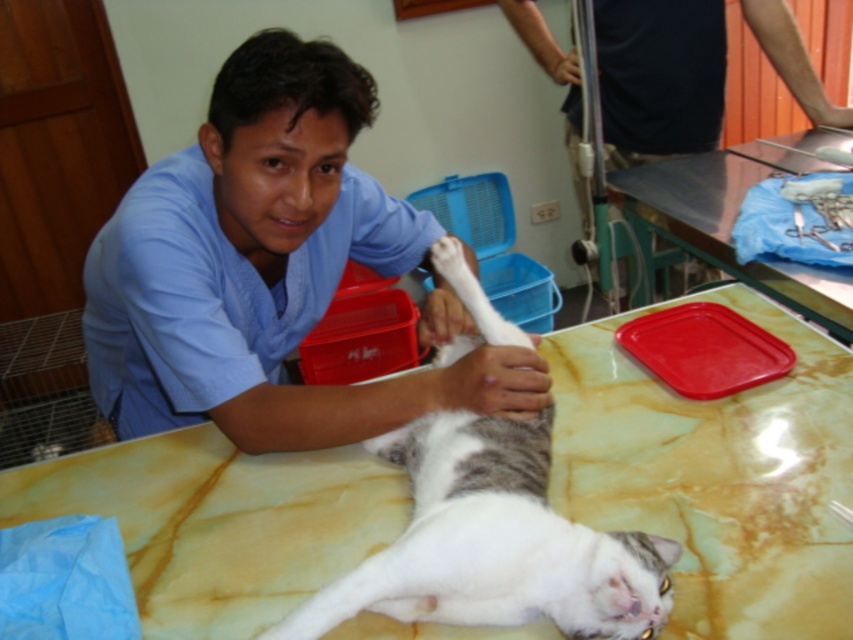
Question: Does white fur cat at center appear under red plastic tray at upper right?

Choices:
 (A) no
 (B) yes

Answer: (B)

Question: Based on their relative distances, which object is farther from the red plastic tray at upper right?

Choices:
 (A) dark blue scrubs at upper left
 (B) blue scrubs at upper left
 (C) white fur cat at center

Answer: (B)

Question: Is white fur cat at center further to the viewer compared to dark blue scrubs at upper left?

Choices:
 (A) yes
 (B) no

Answer: (B)

Question: Which object is farther from the camera taking this photo?

Choices:
 (A) dark blue scrubs at upper left
 (B) red plastic tray at upper right

Answer: (A)

Question: Which point is farther from the camera taking this photo?

Choices:
 (A) click(549, 67)
 (B) click(444, 486)
 (C) click(722, 218)
 (D) click(280, 241)

Answer: (A)

Question: Observing the image, what is the correct spatial positioning of blue scrubs at upper left in reference to red plastic tray at upper right?

Choices:
 (A) above
 (B) below

Answer: (B)